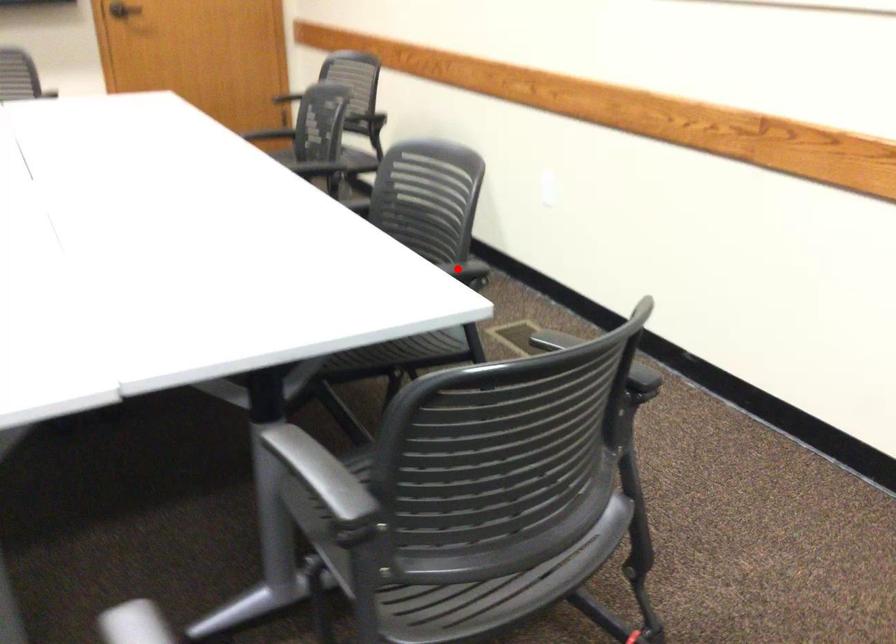
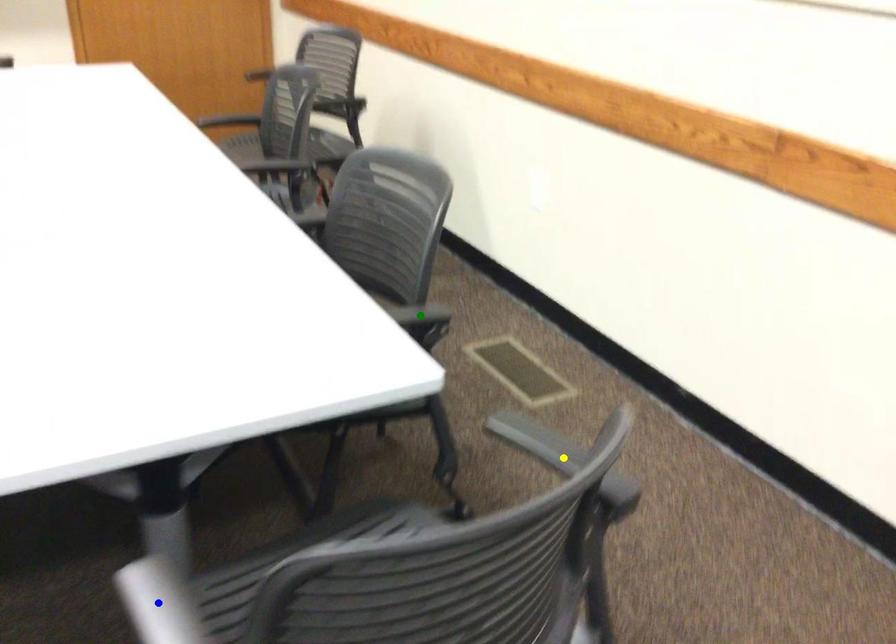
Question: I am providing you with two images of the same scene from different viewpoints. A red point is marked on the first image. You are given multiple points on the second image. Which point in image 2 is actually the same real-world point as the red point in image 1?

Choices:
 (A) yellow point
 (B) green point
 (C) blue point

Answer: (B)